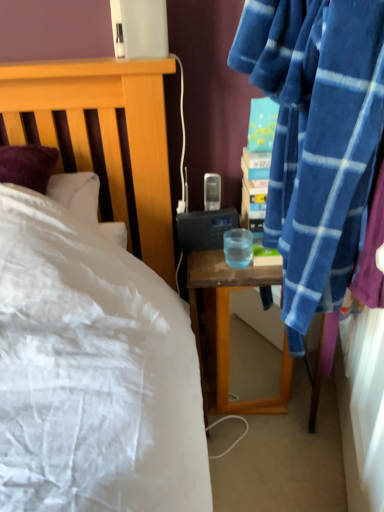
Question: In the image, is wooden desk at right positioned in front of or behind transparent plastic cup at bedside table?

Choices:
 (A) behind
 (B) front

Answer: (A)

Question: Is wooden desk at right inside or outside of transparent plastic cup at bedside table?

Choices:
 (A) inside
 (B) outside

Answer: (B)

Question: From the image's perspective, is wooden desk at right above or below transparent plastic cup at bedside table?

Choices:
 (A) below
 (B) above

Answer: (A)

Question: In terms of size, does transparent plastic cup at bedside table appear bigger or smaller than wooden desk at right?

Choices:
 (A) small
 (B) big

Answer: (A)

Question: Relative to wooden desk at right, is transparent plastic cup at bedside table in front or behind?

Choices:
 (A) behind
 (B) front

Answer: (B)

Question: In terms of width, does transparent plastic cup at bedside table look wider or thinner when compared to wooden desk at right?

Choices:
 (A) thin
 (B) wide

Answer: (A)

Question: From the image's perspective, is transparent plastic cup at bedside table positioned above or below wooden desk at right?

Choices:
 (A) below
 (B) above

Answer: (B)